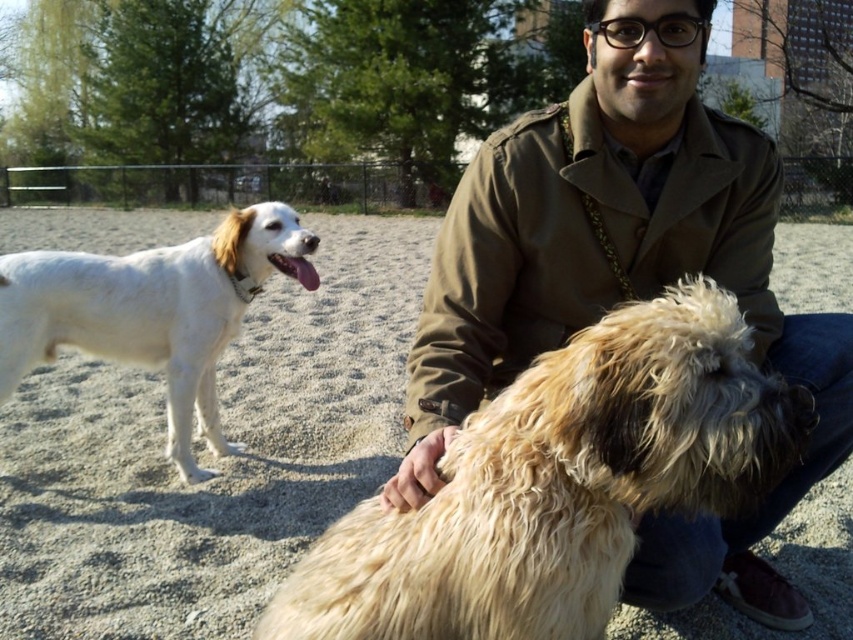
Question: Observing the image, what is the correct spatial positioning of brown textured coat at center in reference to white fur dog at left?

Choices:
 (A) right
 (B) left

Answer: (A)

Question: Where is fluffy beige dog at center located in relation to white fur dog at left in the image?

Choices:
 (A) right
 (B) left

Answer: (A)

Question: Which of the following is the closest to the observer?

Choices:
 (A) brown textured coat at center
 (B) white fur dog at left
 (C) fluffy beige dog at center

Answer: (C)

Question: Considering the real-world distances, which object is farthest from the fluffy beige dog at center?

Choices:
 (A) white fur dog at left
 (B) brown textured coat at center

Answer: (A)

Question: Does fluffy beige dog at center have a larger size compared to white fur dog at left?

Choices:
 (A) yes
 (B) no

Answer: (B)

Question: Which point is farther to the camera?

Choices:
 (A) fluffy beige dog at center
 (B) brown textured coat at center

Answer: (B)